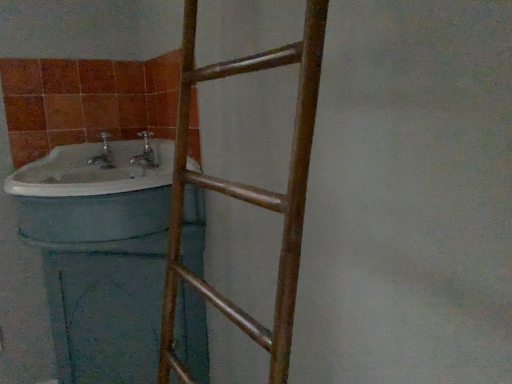
Question: Looking at the image, does brown wooden ladder at center seem bigger or smaller compared to white glossy sink at left?

Choices:
 (A) small
 (B) big

Answer: (B)

Question: Considering their positions, is brown wooden ladder at center located in front of or behind white glossy sink at left?

Choices:
 (A) front
 (B) behind

Answer: (A)

Question: Considering the relative positions of brown wooden ladder at center and white glossy sink at left in the image provided, is brown wooden ladder at center to the left or to the right of white glossy sink at left?

Choices:
 (A) right
 (B) left

Answer: (A)

Question: Choose the correct answer: Is white glossy sink at left inside brown wooden ladder at center or outside it?

Choices:
 (A) outside
 (B) inside

Answer: (A)

Question: From the image's perspective, relative to brown wooden ladder at center, is white glossy sink at left above or below?

Choices:
 (A) above
 (B) below

Answer: (A)

Question: Does point (130, 211) appear closer or farther from the camera than point (272, 193)?

Choices:
 (A) farther
 (B) closer

Answer: (A)

Question: Visually, is white glossy sink at left positioned to the left or to the right of brown wooden ladder at center?

Choices:
 (A) left
 (B) right

Answer: (A)